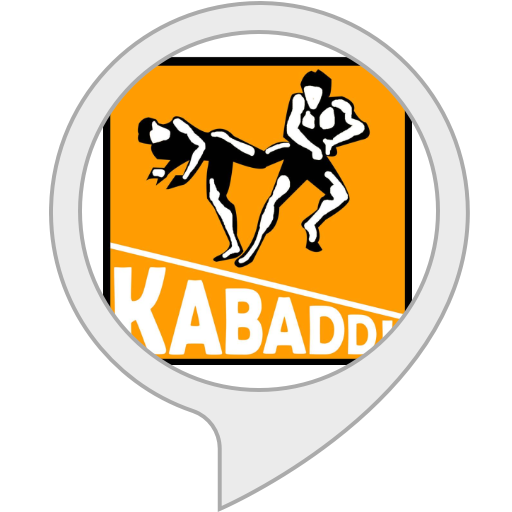
Identify the location of dark grey trim. The height and width of the screenshot is (512, 512). (221, 505).